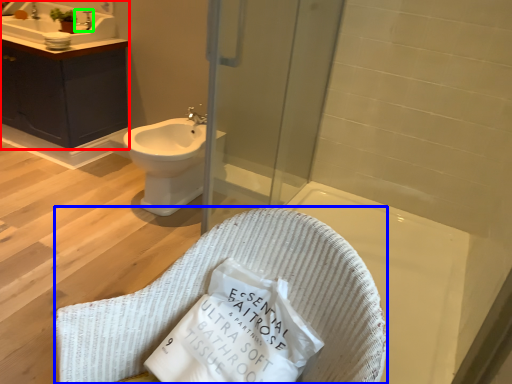
Question: Which object is positioned closest to bathroom cabinet (highlighted by a red box)? Select from rocking chair (highlighted by a blue box) and faucet (highlighted by a green box).

Choices:
 (A) rocking chair
 (B) faucet

Answer: (B)